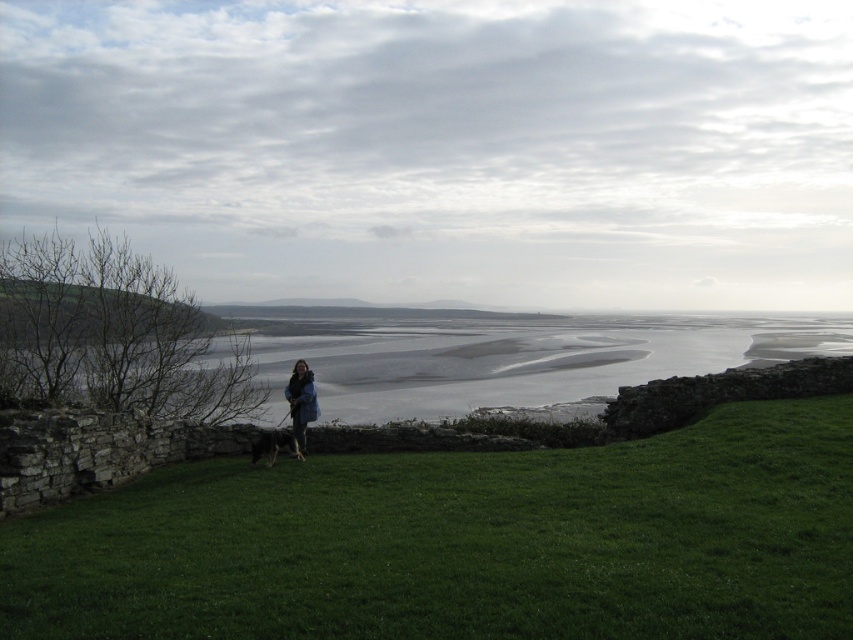
You are a GUI agent. You are given a task and a screenshot of the screen. Output one action in this format:
    pyautogui.click(x=<x>, y=<y>)
    Task: Click on the green grassy at lower center
    
    Given the screenshot: What is the action you would take?
    pyautogui.click(x=463, y=541)

Does green grassy at lower center appear over gray sand at lower center?

No, green grassy at lower center is not above gray sand at lower center.

The height and width of the screenshot is (640, 853). Describe the element at coordinates (463, 541) in the screenshot. I see `green grassy at lower center` at that location.

This screenshot has height=640, width=853. I want to click on green grassy at lower center, so click(x=463, y=541).

Does point (296, 385) come behind point (286, 440)?

That is True.

Locate an element on the screen. This screenshot has height=640, width=853. dark blue jacket at center is located at coordinates (300, 401).

The height and width of the screenshot is (640, 853). Identify the location of dark blue jacket at center. (300, 401).

This screenshot has width=853, height=640. Describe the element at coordinates (463, 541) in the screenshot. I see `green grassy at lower center` at that location.

Is the position of green grassy at lower center more distant than that of brown fur dog at center?

No, green grassy at lower center is in front of brown fur dog at center.

Is point (337, 580) more distant than point (292, 435)?

No, (337, 580) is in front of (292, 435).

This screenshot has height=640, width=853. I want to click on green grassy at lower center, so click(x=463, y=541).